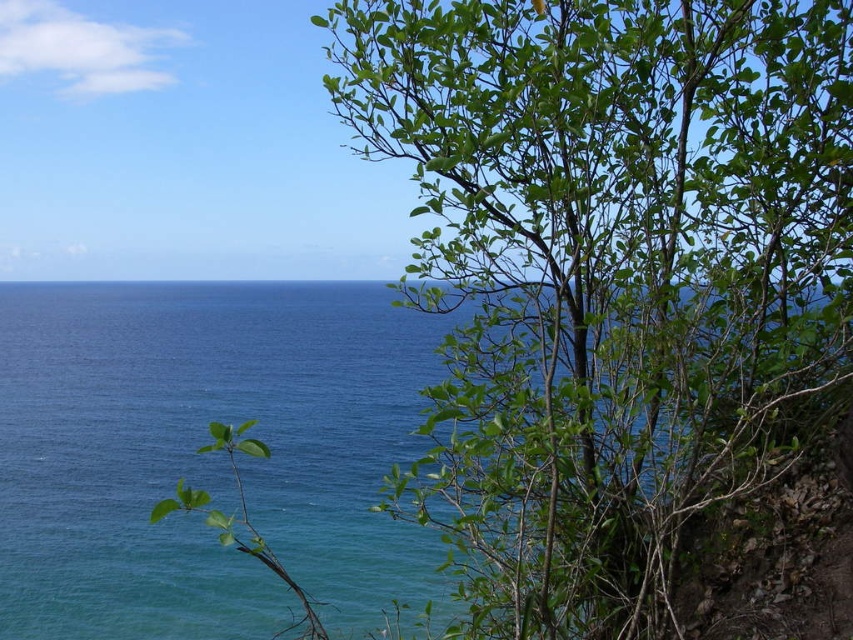
You are standing on the beach and want to place a 3m wide tent between the green leafy bush at right and the blue water at center. Can the space between them accommodate the tent?

The green leafy bush at right is narrower than the blue water at center, but the exact distance between them isn